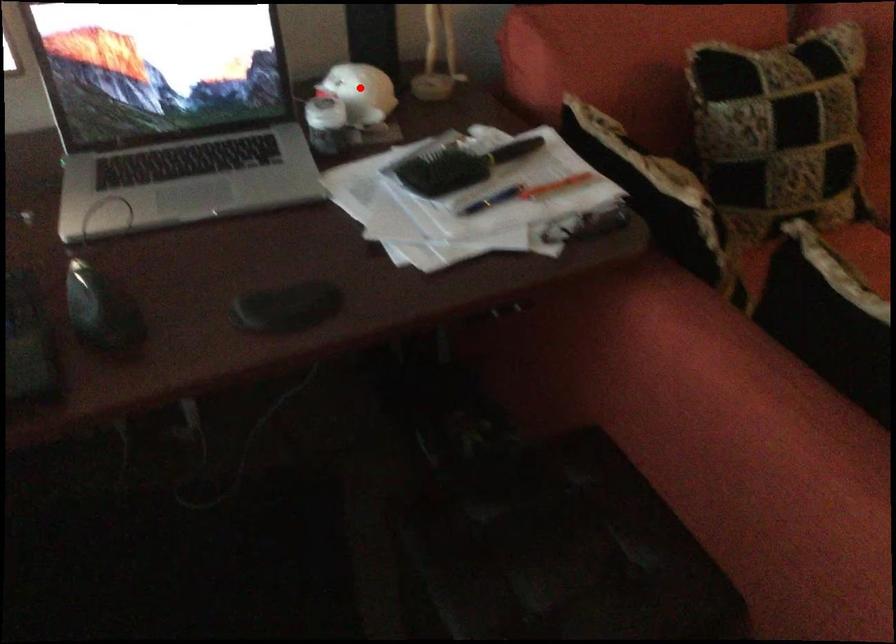
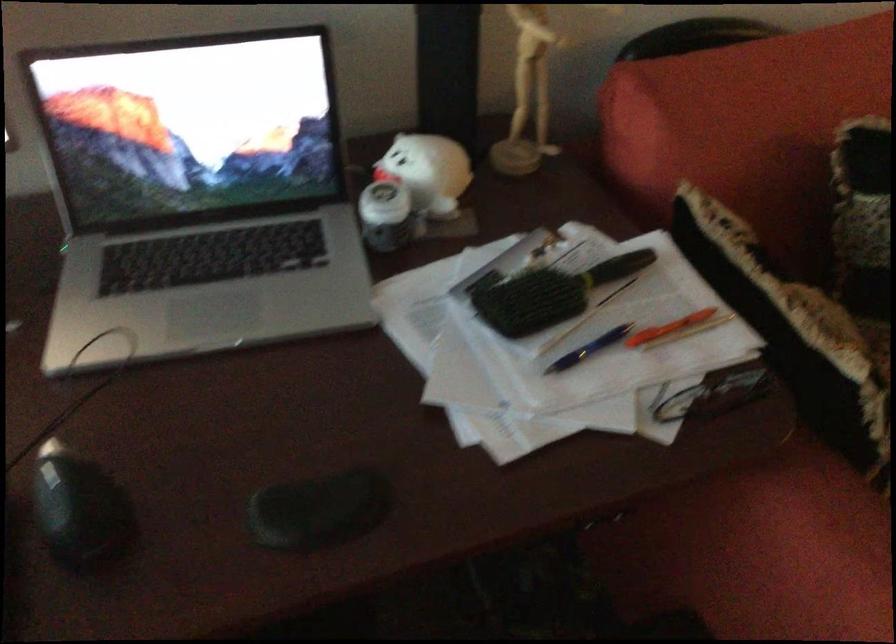
Question: I am providing you with two images of the same scene from different viewpoints. A red point is shown in image1. For the corresponding object point in image2, is it positioned nearer or farther from the camera?

Choices:
 (A) Nearer
 (B) Farther

Answer: (A)